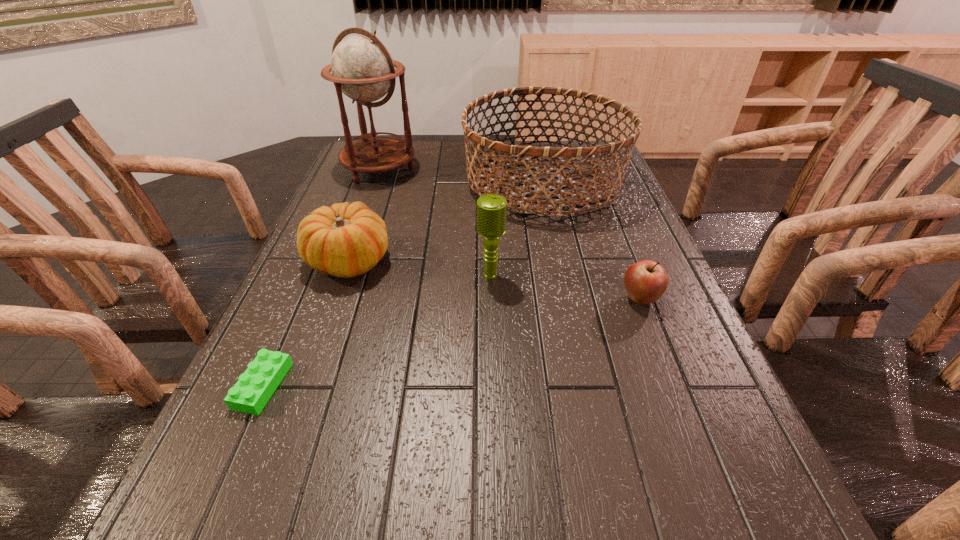
Identify the location of vacant space situated on the right of the fourth tallest object. (412, 261).

In order to click on vacant space located on the front of the apple in this screenshot , I will do `click(685, 415)`.

I want to click on free space located 0.100m on the front of the shortest object, so click(224, 475).

Where is `globe that is at the far edge`? globe that is at the far edge is located at coordinates (362, 68).

This screenshot has width=960, height=540. I want to click on basket at the far edge, so click(593, 151).

This screenshot has height=540, width=960. Identify the location of globe that is positioned at the left edge. (362, 68).

Locate an element on the screen. The width and height of the screenshot is (960, 540). gourd that is at the left edge is located at coordinates (345, 240).

You are a GUI agent. You are given a task and a screenshot of the screen. Output one action in this format:
    pyautogui.click(x=<x>, y=<y>)
    Task: Click on the Lego at the left edge
    The image size is (960, 540).
    Given the screenshot: What is the action you would take?
    pyautogui.click(x=250, y=394)

You are a GUI agent. You are given a task and a screenshot of the screen. Output one action in this format:
    pyautogui.click(x=<x>, y=<y>)
    Task: Click on the basket at the right edge
    This screenshot has height=540, width=960.
    Given the screenshot: What is the action you would take?
    pyautogui.click(x=593, y=151)

Identify the location of apple situated at the right edge. (646, 281).